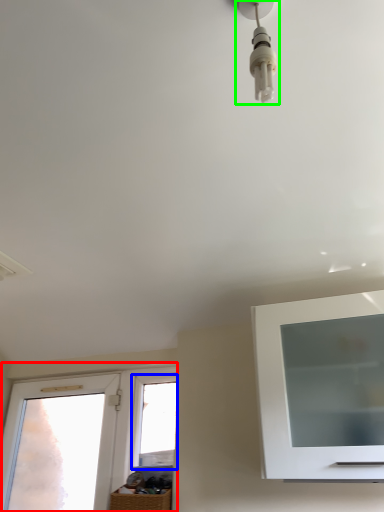
Question: Estimate the real-world distances between objects in this image. Which object is farther from window (highlighted by a red box), window (highlighted by a blue box) or light fixture (highlighted by a green box)?

Choices:
 (A) window
 (B) light fixture

Answer: (B)